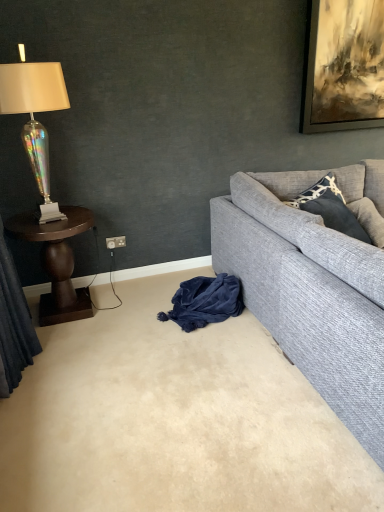
Question: Is dark gray textured pillow at upper right facing away from velvet blue blanket at lower center?

Choices:
 (A) yes
 (B) no

Answer: (B)

Question: Is the depth of dark gray textured pillow at upper right less than that of velvet blue blanket at lower center?

Choices:
 (A) yes
 (B) no

Answer: (B)

Question: From the image's perspective, would you say dark gray textured pillow at upper right is shown under velvet blue blanket at lower center?

Choices:
 (A) no
 (B) yes

Answer: (A)

Question: From the image's perspective, is dark gray textured pillow at upper right on top of velvet blue blanket at lower center?

Choices:
 (A) yes
 (B) no

Answer: (A)

Question: Is dark gray textured pillow at upper right at the left side of velvet blue blanket at lower center?

Choices:
 (A) no
 (B) yes

Answer: (A)

Question: From a real-world perspective, is dark gray textured pillow at upper right physically below velvet blue blanket at lower center?

Choices:
 (A) no
 (B) yes

Answer: (A)

Question: Could you tell me if dark wood side table at left is turned towards iridescent glass lamp at left?

Choices:
 (A) yes
 (B) no

Answer: (B)

Question: Considering the relative positions of dark wood side table at left and iridescent glass lamp at left in the image provided, is dark wood side table at left in front of iridescent glass lamp at left?

Choices:
 (A) yes
 (B) no

Answer: (B)

Question: Can you confirm if dark wood side table at left is taller than iridescent glass lamp at left?

Choices:
 (A) no
 (B) yes

Answer: (A)

Question: Is dark wood side table at left not close to iridescent glass lamp at left?

Choices:
 (A) no
 (B) yes

Answer: (A)

Question: From the image's perspective, is dark wood side table at left on iridescent glass lamp at left?

Choices:
 (A) no
 (B) yes

Answer: (A)

Question: From a real-world perspective, is dark wood side table at left positioned over iridescent glass lamp at left based on gravity?

Choices:
 (A) no
 (B) yes

Answer: (A)

Question: Does iridescent glass lamp at left lie in front of dark wood side table at left?

Choices:
 (A) no
 (B) yes

Answer: (B)